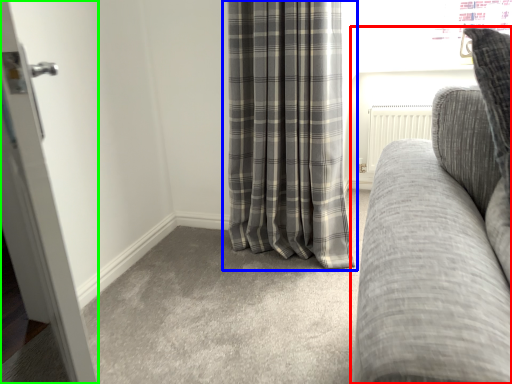
Question: Based on their relative distances, which object is farther from studio couch (highlighted by a red box)? Choose from curtain (highlighted by a blue box) and door (highlighted by a green box).

Choices:
 (A) curtain
 (B) door

Answer: (A)